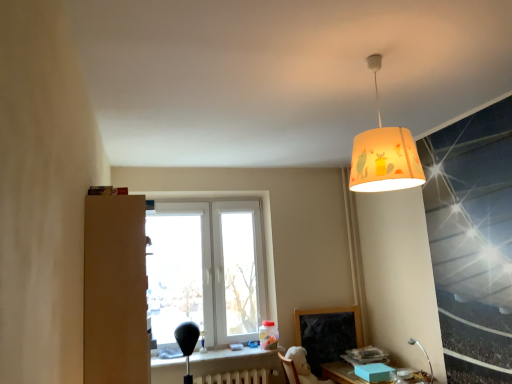
What are the coordinates of `vacant space situated above matte yellow lampshade at upper center (from a real-world perspective)` in the screenshot? It's located at (372, 59).